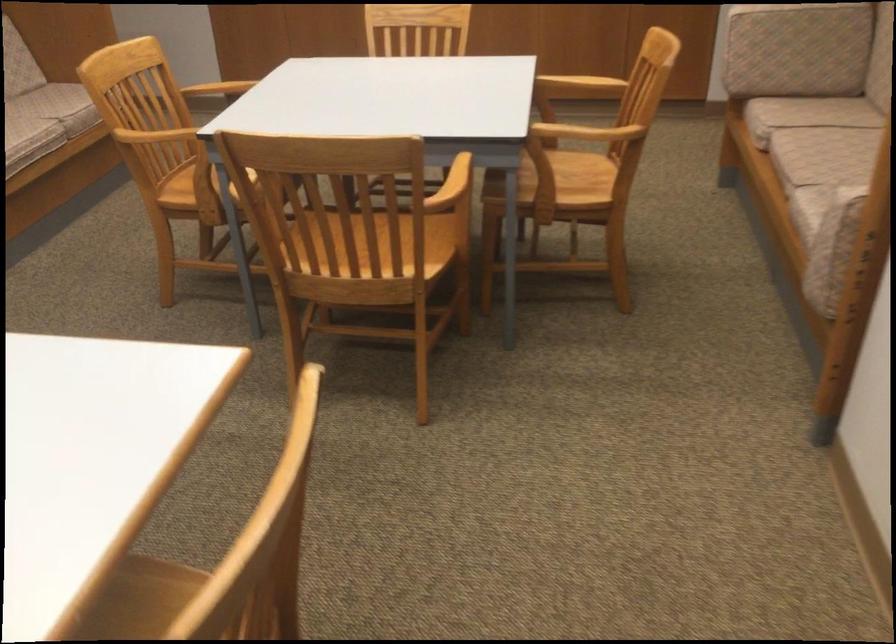
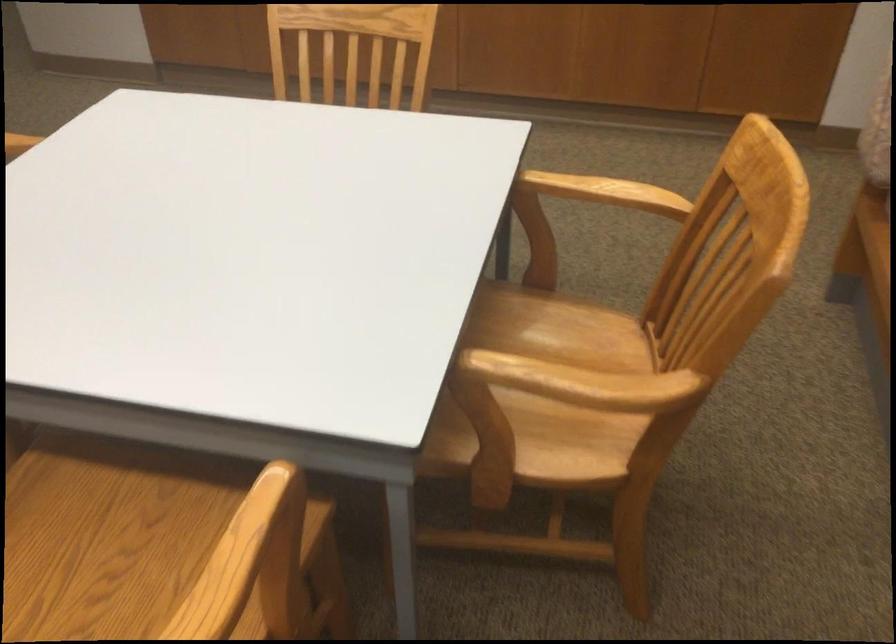
Locate, in the second image, the point that corresponds to (581,75) in the first image.

(605, 192)